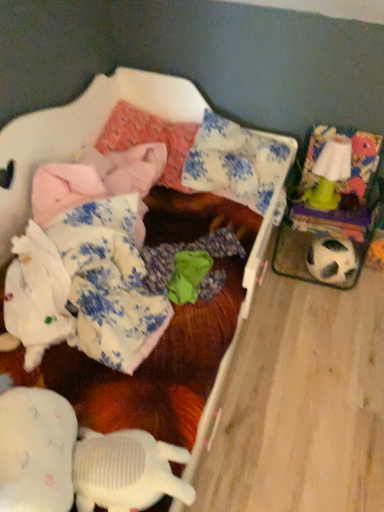
You are a GUI agent. You are given a task and a screenshot of the screen. Output one action in this format:
    pyautogui.click(x=<x>, y=<y>)
    Task: Click on the free space above black and white textured football at right (from a real-world perspective)
    This screenshot has height=512, width=384.
    Given the screenshot: What is the action you would take?
    tap(342, 246)